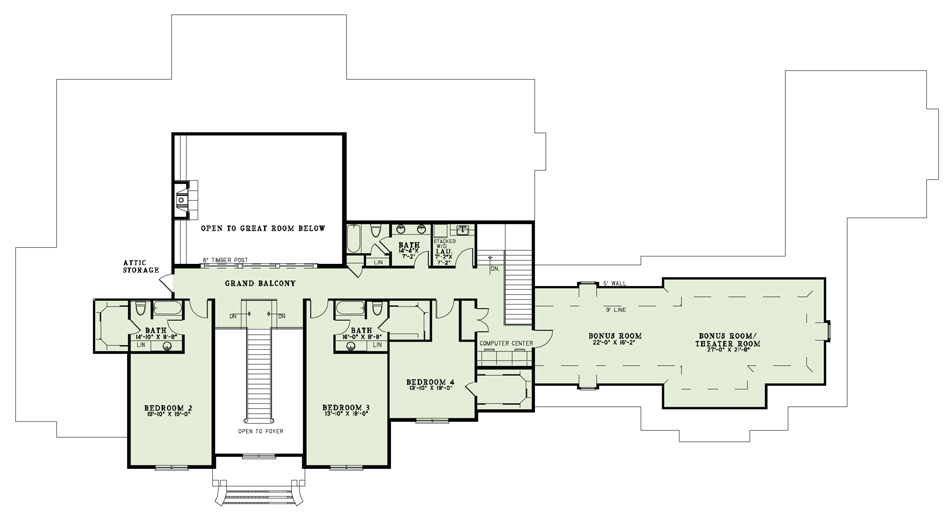
Find the location of a particular element. This screenshot has height=517, width=950. extra fun room is located at coordinates (615, 338).